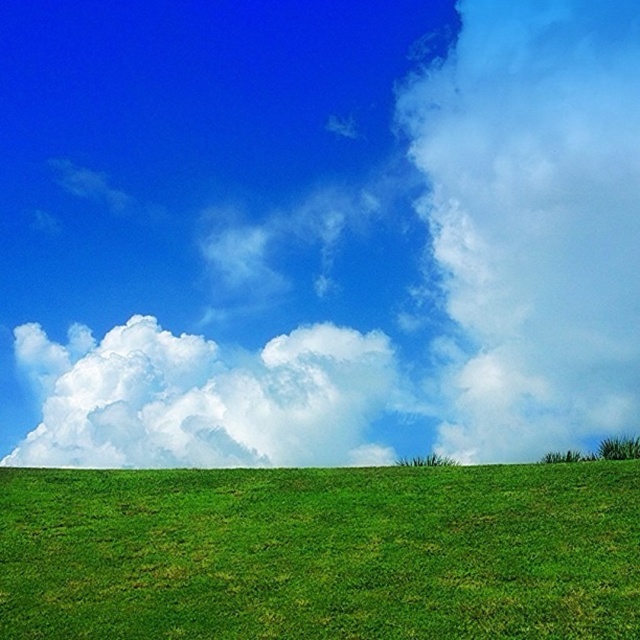
You are a bird soaring in the sky and want to land on the green grassy hill at lower center. Can you safely land there without hitting the white fluffy cloud at center?

The green grassy hill at lower center is shorter than the white fluffy cloud at center, so you can safely land on the green grassy hill at lower center without hitting the cloud.

You are standing in the middle of the green grassy field and see the point marked at coordinates (316, 230). What is located at that point?

The point at coordinates (316, 230) marks green grass at lower center.

You are a gardener planning to mow the lawn. You see the green grass at lower center and the green grassy hill at lower center. Which area should you mow first if you want to start with the taller vegetation?

The green grass at lower center should be mowed first since it has a greater height compared to the green grassy hill at lower center, as stated in the description.